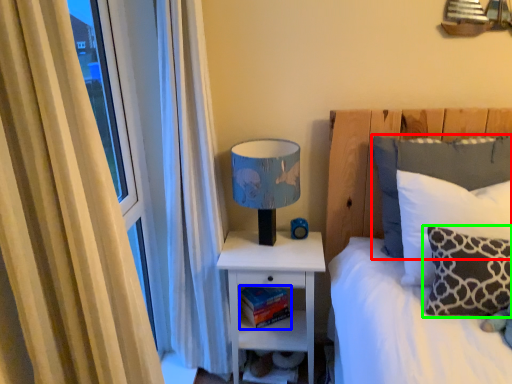
Question: Which object is the closest to the pillow (highlighted by a red box)? Choose among these: book (highlighted by a blue box) or pillow (highlighted by a green box).

Choices:
 (A) book
 (B) pillow

Answer: (B)